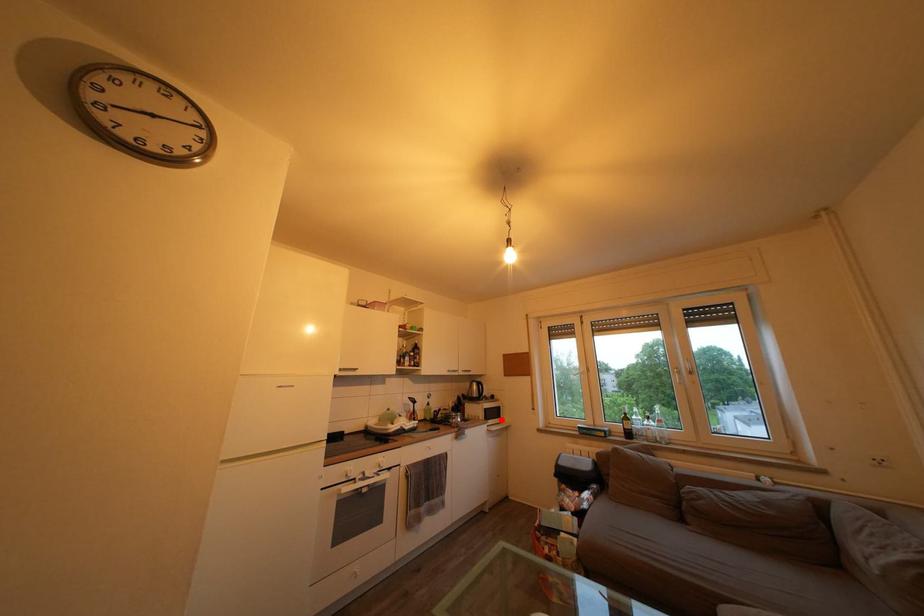
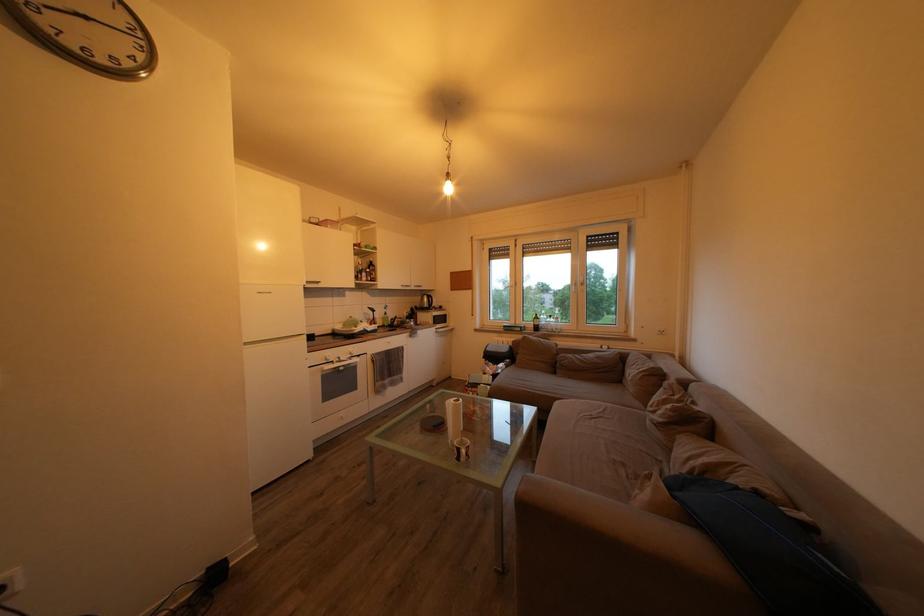
Where in the second image is the point corresponding to the highlighted location from the first image?

(448, 326)